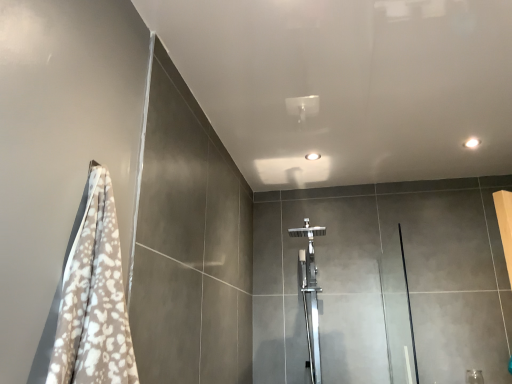
Question: Looking at the image, does transparent glass screen door at right seem bigger or smaller compared to polished chrome shower at center?

Choices:
 (A) big
 (B) small

Answer: (B)

Question: Considering the positions of transparent glass screen door at right and polished chrome shower at center in the image, is transparent glass screen door at right taller or shorter than polished chrome shower at center?

Choices:
 (A) short
 (B) tall

Answer: (A)

Question: From the image's perspective, is transparent glass screen door at right positioned above or below polished chrome shower at center?

Choices:
 (A) below
 (B) above

Answer: (A)

Question: From a real-world perspective, is polished chrome shower at center physically located above or below transparent glass screen door at right?

Choices:
 (A) above
 (B) below

Answer: (A)

Question: Is polished chrome shower at center taller or shorter than transparent glass screen door at right?

Choices:
 (A) tall
 (B) short

Answer: (A)

Question: Is point (315, 334) closer or farther from the camera than point (401, 288)?

Choices:
 (A) farther
 (B) closer

Answer: (A)

Question: Considering the positions of polished chrome shower at center and transparent glass screen door at right in the image, is polished chrome shower at center bigger or smaller than transparent glass screen door at right?

Choices:
 (A) small
 (B) big

Answer: (B)